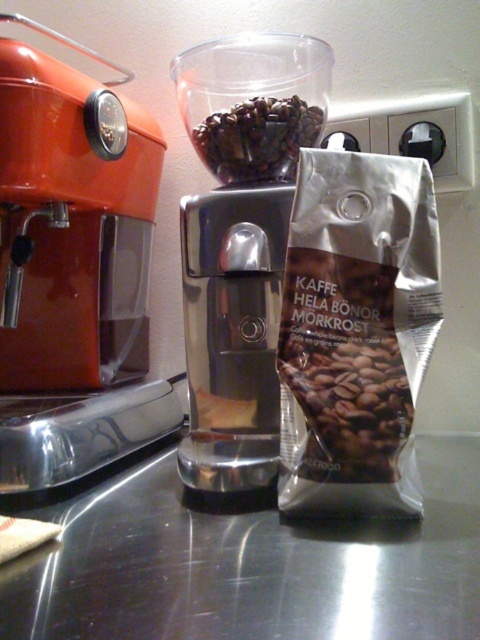
Is metallic reflective surface at center below dark matte coffee beans at center?

Indeed, metallic reflective surface at center is positioned under dark matte coffee beans at center.

Is point (93, 540) positioned behind point (230, 136)?

No, it is not.

The height and width of the screenshot is (640, 480). I want to click on metallic reflective surface at center, so click(x=248, y=563).

Where is `transparent plastic blender at center`? This screenshot has width=480, height=640. transparent plastic blender at center is located at coordinates (240, 241).

Is point (359, 563) less distant than point (336, 371)?

Yes, point (359, 563) is closer to viewer.

Measure the distance between metallic reflective surface at center and silver metallic coffee bag at lower right.

A distance of 14.78 centimeters exists between metallic reflective surface at center and silver metallic coffee bag at lower right.

The width and height of the screenshot is (480, 640). What do you see at coordinates (248, 563) in the screenshot?
I see `metallic reflective surface at center` at bounding box center [248, 563].

Find the location of a particular element. metallic reflective surface at center is located at coordinates (248, 563).